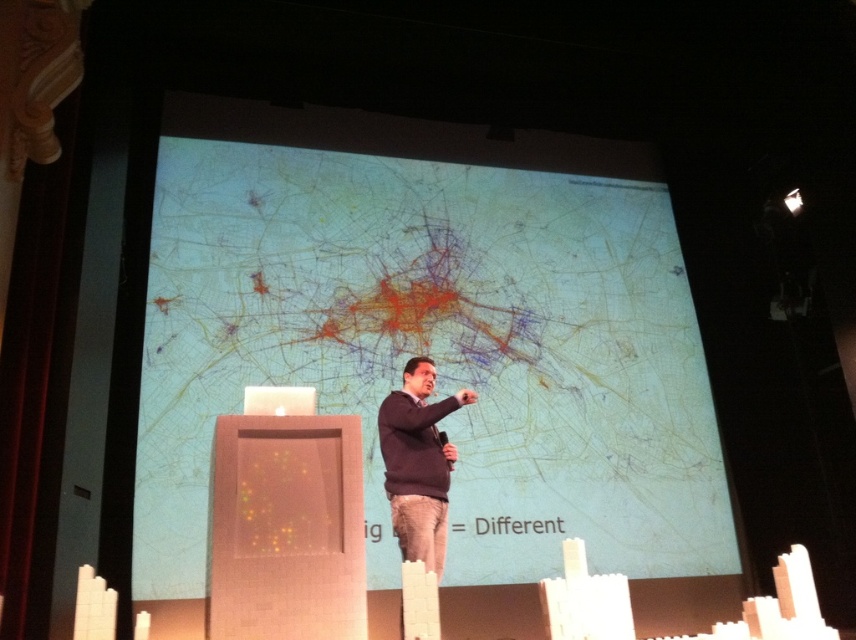
You are sitting in the front row of the audience, and you want to see both the speaker and the matte plastic projection screen at center clearly. The recommended viewing distance for the screen is 12 feet to ensure optimal visibility. Is your current position suitable for viewing both comfortably?

The distance between you and the matte plastic projection screen at center is 13.45 feet, which is slightly beyond the recommended 12 feet. This may make it harder to see the screen clearly, but you can still see the speaker comfortably from your current position.

You are an attendee at the presentation and want to see both the speaker and the map on the screen clearly. Which object is closer to you, the matte plastic projection screen at center or the dark blue sweater at center?

The dark blue sweater at center is behind the matte plastic projection screen at center, so the matte plastic projection screen at center is closer to you.